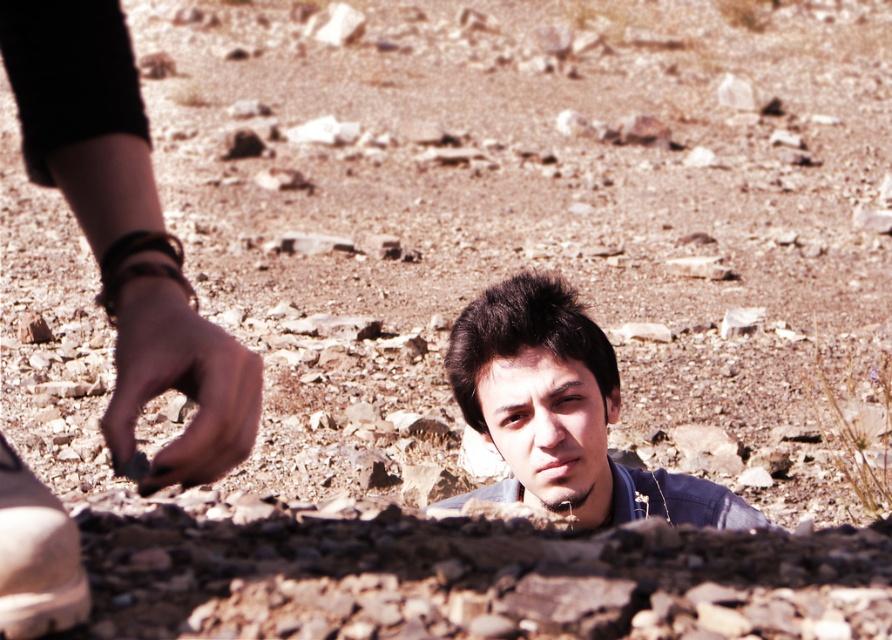
Question: Is dark blue shirt at center bigger than white matte shoe at lower left?

Choices:
 (A) yes
 (B) no

Answer: (A)

Question: Is dark blue shirt at center above white matte shoe at lower left?

Choices:
 (A) no
 (B) yes

Answer: (A)

Question: Which of the following is the farthest from the observer?

Choices:
 (A) (54, 576)
 (B) (659, 502)

Answer: (B)

Question: Which object is closer to the camera taking this photo?

Choices:
 (A) white matte shoe at lower left
 (B) dark blue shirt at center

Answer: (A)

Question: Does dark blue shirt at center have a greater width compared to white matte shoe at lower left?

Choices:
 (A) no
 (B) yes

Answer: (B)